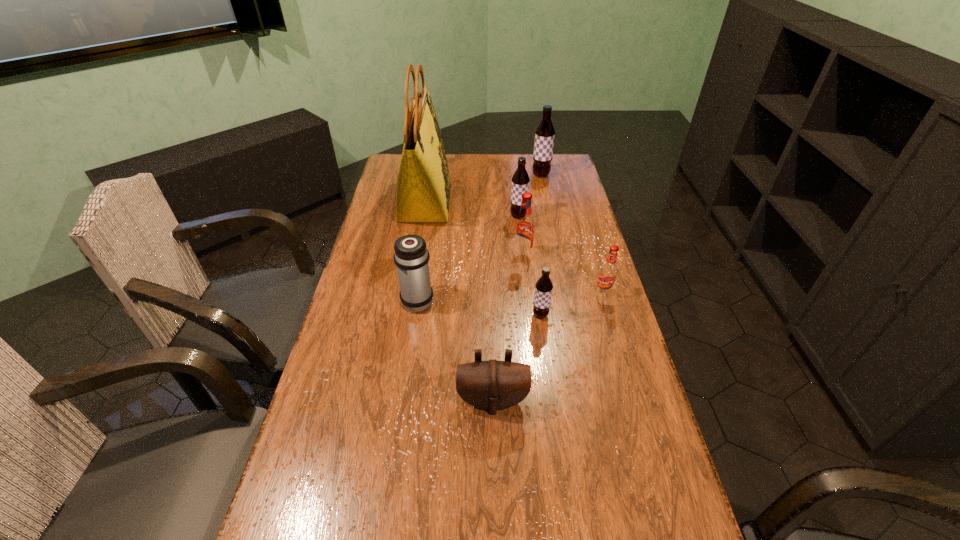
This screenshot has width=960, height=540. What are the coordinates of `vacant space that's between the thermos bottle and the second nearest brown root beer` in the screenshot? It's located at (468, 258).

The width and height of the screenshot is (960, 540). Find the location of `vacant area between the pouch and the seventh shortest object`. vacant area between the pouch and the seventh shortest object is located at coordinates (516, 288).

The image size is (960, 540). I want to click on free space between the bigger red root beer and the nearest root beer, so click(x=532, y=285).

Locate which object is the third closest to the shortest object. Please provide its 2D coordinates. Your answer should be formatted as a tuple, i.e. [(x, y)], where the tuple contains the x and y coordinates of a point satisfying the conditions above.

[(608, 272)]

This screenshot has width=960, height=540. Find the location of `object that is the closest to the rightmost root beer`. object that is the closest to the rightmost root beer is located at coordinates (543, 288).

Find the location of a particular element. the fifth closest root beer relative to the tote bag is located at coordinates [x=608, y=272].

The image size is (960, 540). Identify the location of root beer that stands as the fourth closest to the second nearest brown root beer. (543, 288).

I want to click on brown root beer that is the third closest to the left red root beer, so [x=545, y=132].

Identify which brown root beer is located as the nearest to the second farthest brown root beer. Please provide its 2D coordinates. Your answer should be formatted as a tuple, i.e. [(x, y)], where the tuple contains the x and y coordinates of a point satisfying the conditions above.

[(545, 132)]

The width and height of the screenshot is (960, 540). Find the location of `vacant space that satisfies the following two spatial constraints: 1. on the back side of the second object from right to left; 2. on the left side of the third nearest root beer`. vacant space that satisfies the following two spatial constraints: 1. on the back side of the second object from right to left; 2. on the left side of the third nearest root beer is located at coordinates (514, 175).